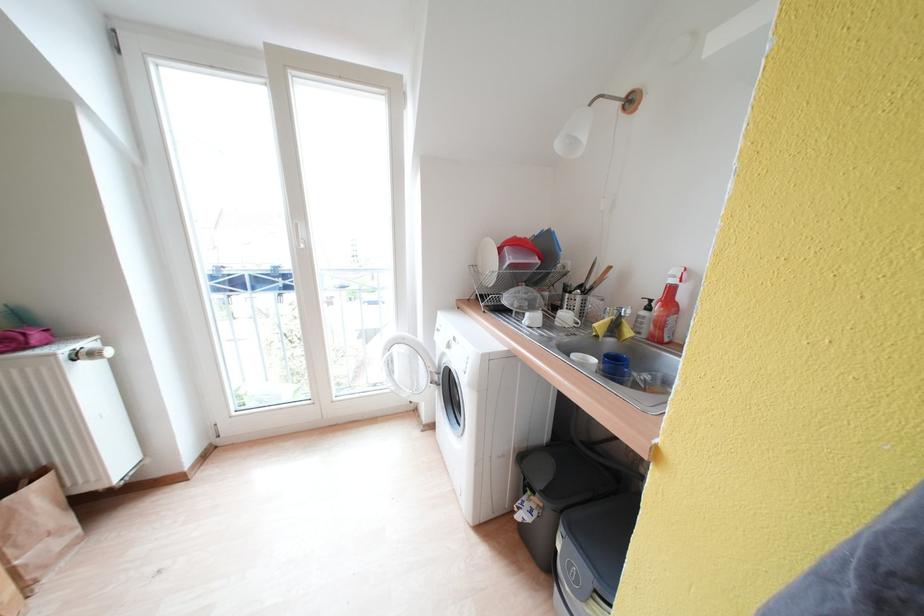
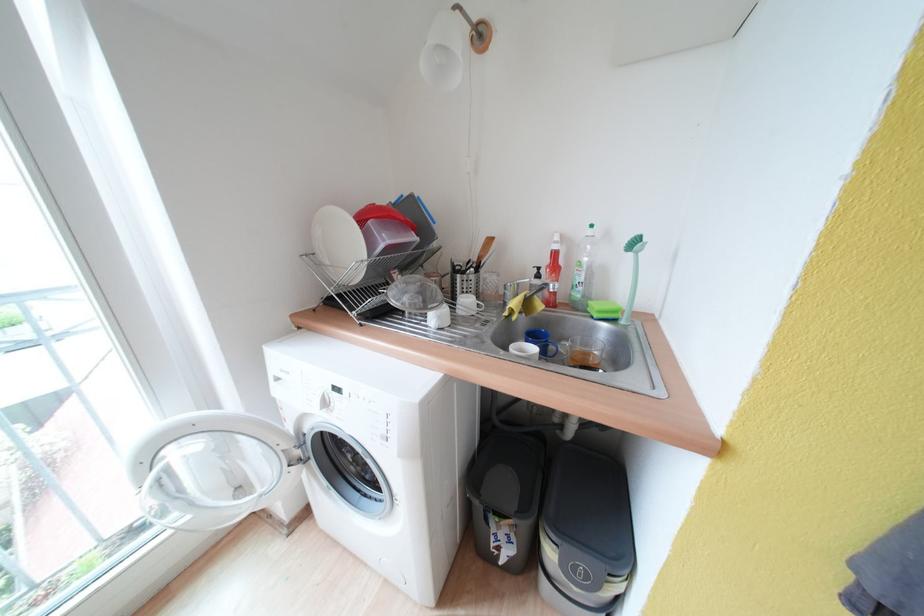
Question: How did the camera likely rotate?

Choices:
 (A) Left
 (B) Right
 (C) Up
 (D) Down

Answer: (B)